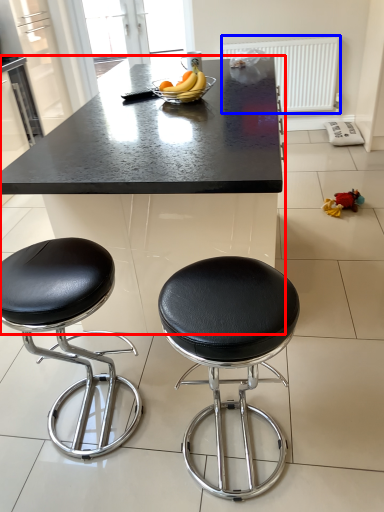
Question: Which point is further to the camera, table (highlighted by a red box) or radiator (highlighted by a blue box)?

Choices:
 (A) table
 (B) radiator

Answer: (B)